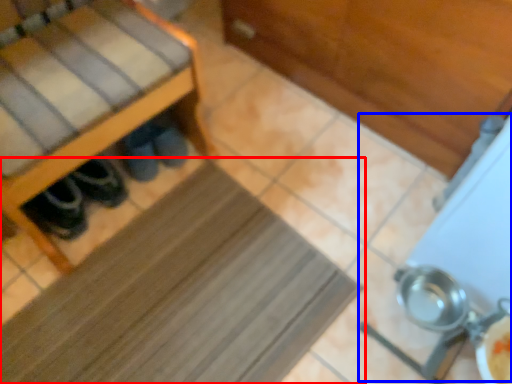
Question: Which point is closer to the camera, mat (highlighted by a red box) or wide (highlighted by a blue box)?

Choices:
 (A) mat
 (B) wide

Answer: (B)